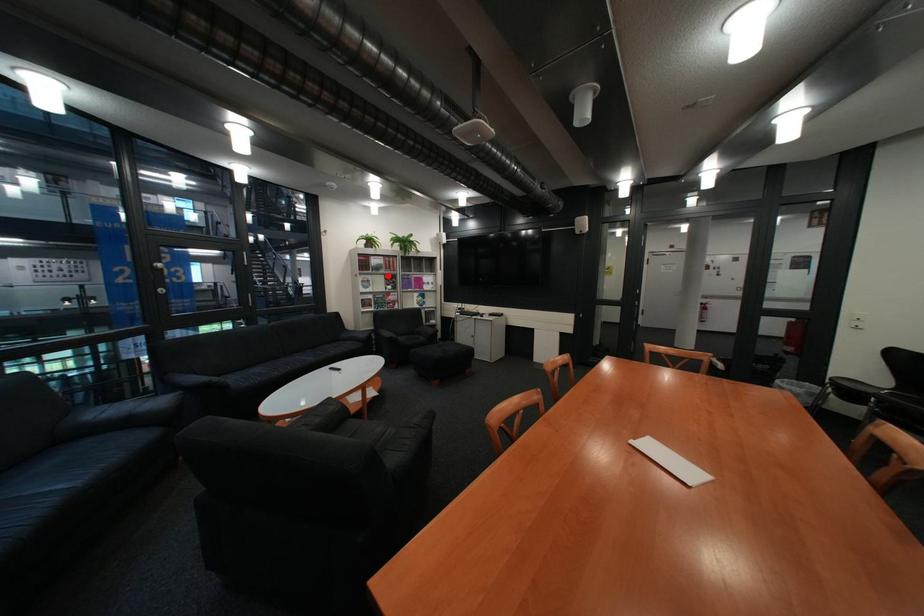
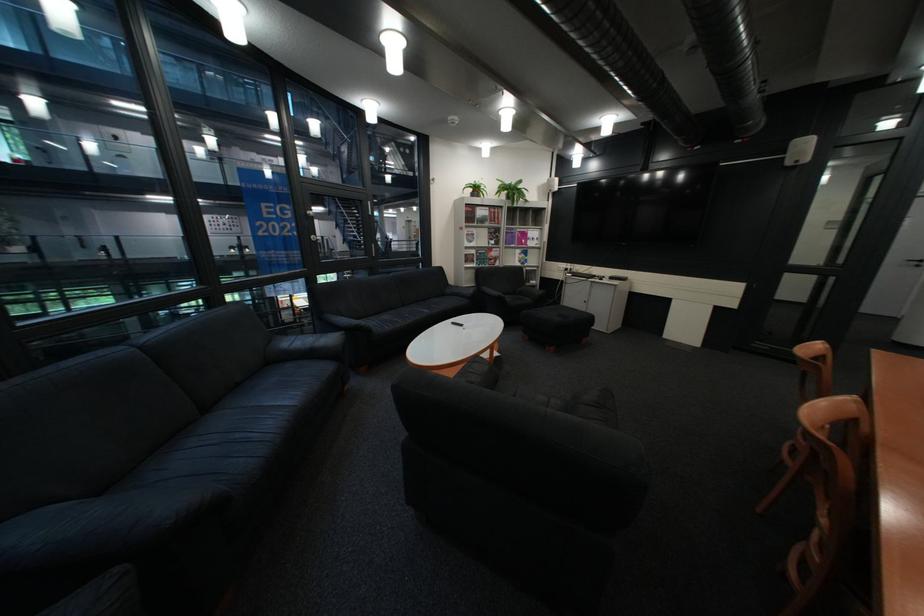
The point at the highlighted location is marked in the first image. Where is the corresponding point in the second image?

(492, 229)